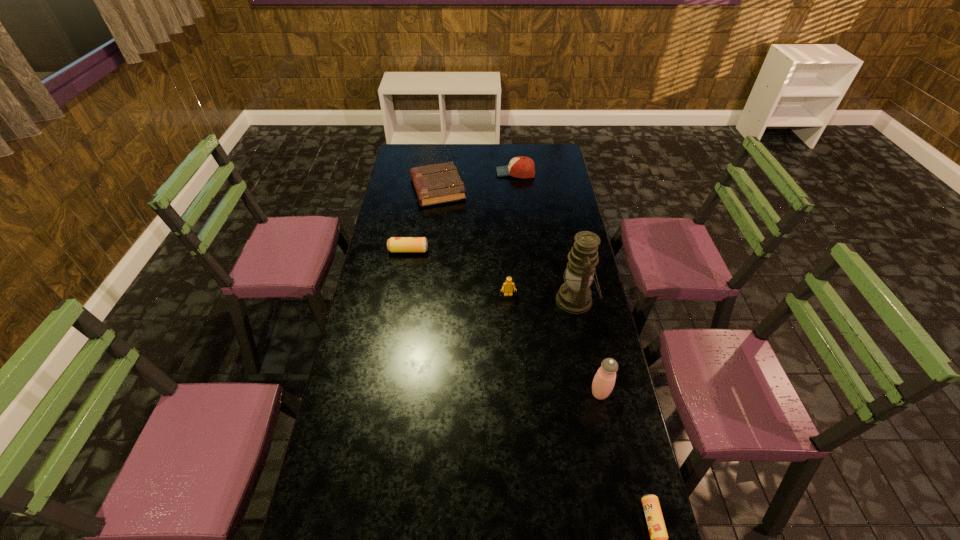
Locate an element on the screen. The height and width of the screenshot is (540, 960). vacant position for inserting another beer_can evenly is located at coordinates (501, 354).